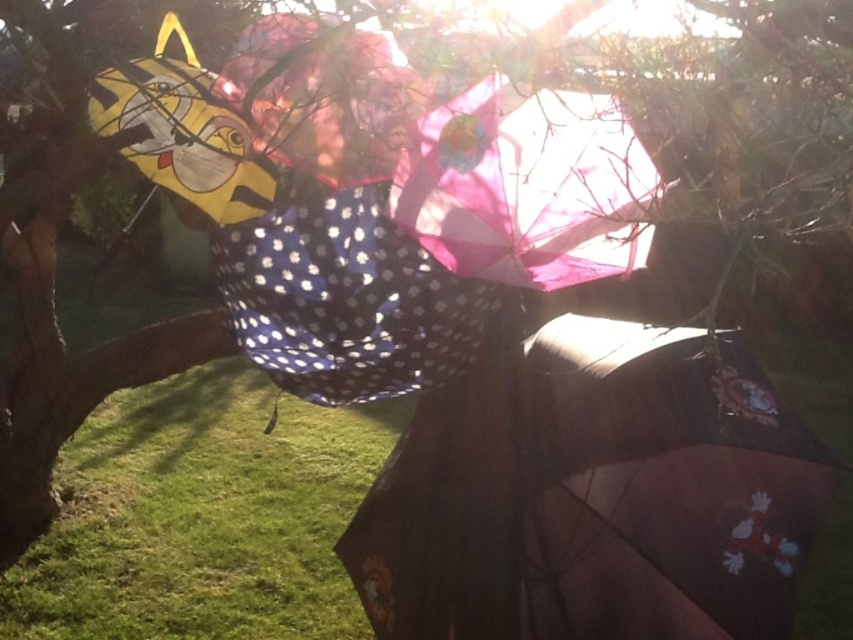
Is the position of pink polka dot umbrella at center more distant than that of yellow matte kite at upper left?

That is False.

Between point (326, 128) and point (161, 156), which one is positioned behind?

Point (161, 156)

Identify the location of pink polka dot umbrella at center. (325, 96).

Is point (496, 516) positioned before point (268, 320)?

That is True.

Is point (341, 554) positioned behind point (381, 349)?

That is True.

Identify the location of dark brown matte umbrella at lower right. The image size is (853, 640). (596, 492).

Is point (614, 392) positioned before point (267, 560)?

Yes, point (614, 392) is in front of point (267, 560).

The height and width of the screenshot is (640, 853). Describe the element at coordinates (596, 492) in the screenshot. I see `dark brown matte umbrella at lower right` at that location.

Image resolution: width=853 pixels, height=640 pixels. Identify the location of dark brown matte umbrella at lower right. (596, 492).

The height and width of the screenshot is (640, 853). What are the coordinates of `dark brown matte umbrella at lower right` in the screenshot? It's located at (596, 492).